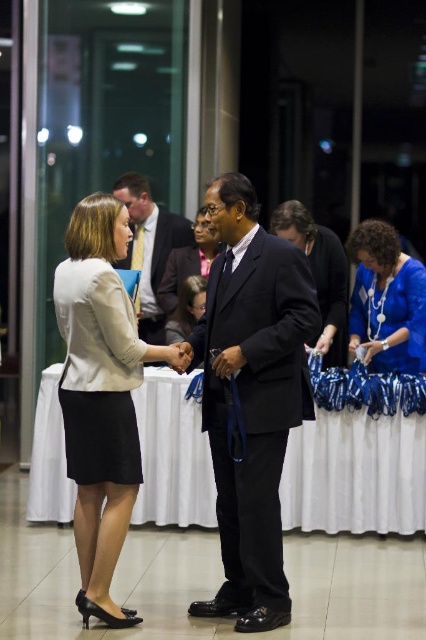
Question: In this image, where is matte black dress at center located relative to matte brown blazer at center?

Choices:
 (A) right
 (B) left

Answer: (A)

Question: Among these points, which one is farthest from the camera?

Choices:
 (A) (192, 230)
 (B) (186, 248)
 (C) (336, 346)

Answer: (A)

Question: Is white cloth table at center positioned at the back of matte beige blazer at center?

Choices:
 (A) yes
 (B) no

Answer: (A)

Question: Is blue satin blouse at lower right closer to the viewer compared to matte black suit at center?

Choices:
 (A) no
 (B) yes

Answer: (B)

Question: Among these objects, which one is farthest from the camera?

Choices:
 (A) matte brown blazer at center
 (B) blue satin blouse at lower right

Answer: (A)

Question: Among these points, which one is nearest to the camera?

Choices:
 (A) (164, 289)
 (B) (345, 296)
 (C) (186, 296)

Answer: (B)